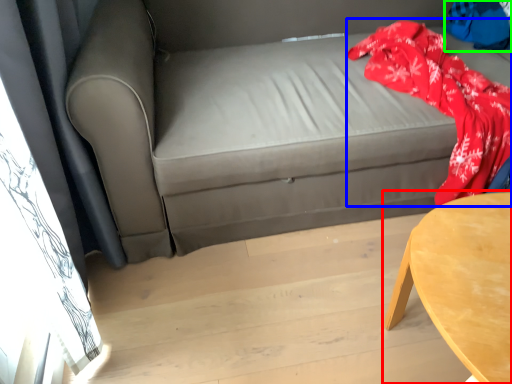
Question: Considering the real-world distances, which object is closest to table (highlighted by a red box)? blanket (highlighted by a blue box) or clothing (highlighted by a green box).

Choices:
 (A) blanket
 (B) clothing

Answer: (A)